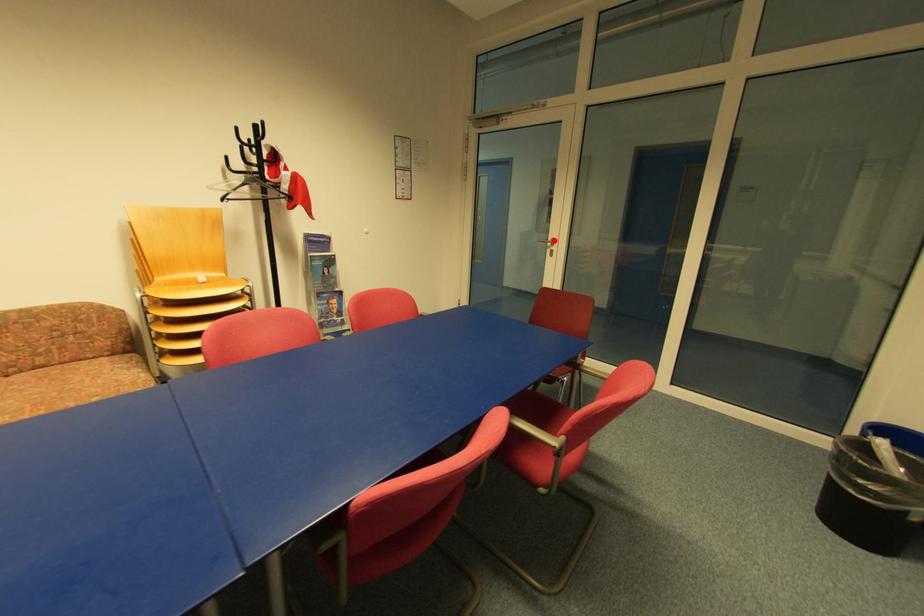
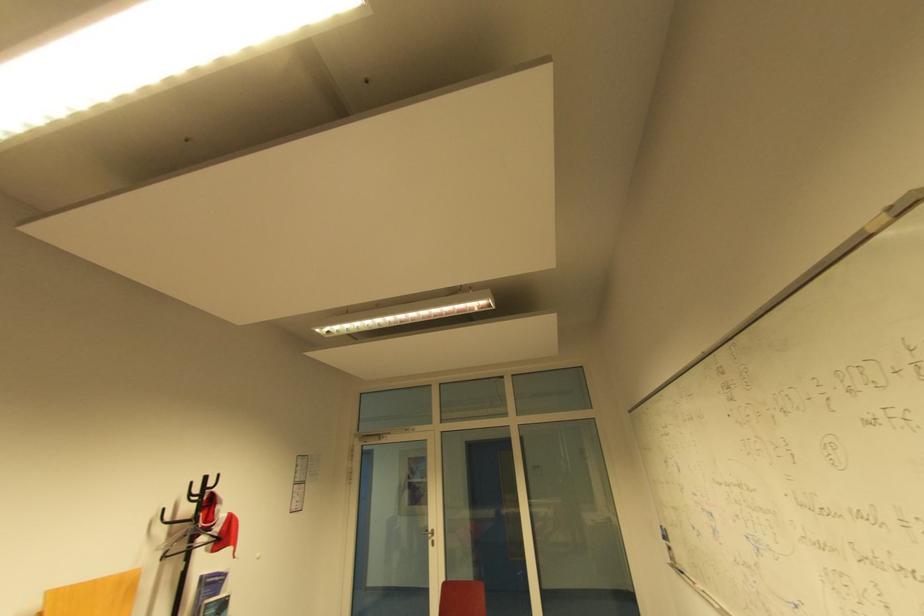
Locate, in the second image, the point that corresponds to the highlighted location in the first image.

(434, 531)